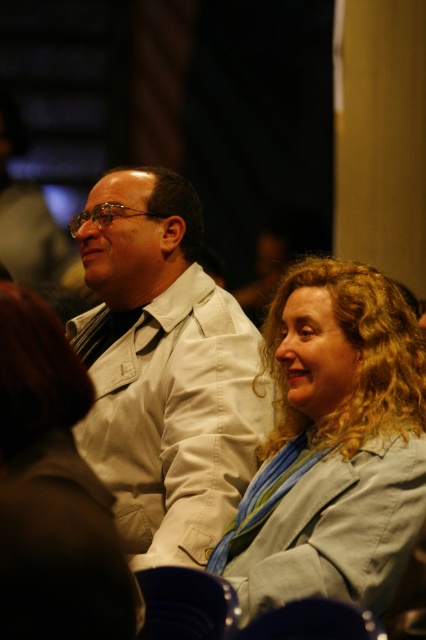
Who is shorter, light beige jacket at center or light blue fabric jacket at center?

With less height is light blue fabric jacket at center.

Who is lower down, light beige jacket at center or light blue fabric jacket at center?

light blue fabric jacket at center is lower down.

Is point (224, 452) closer to viewer compared to point (247, 532)?

No, (224, 452) is behind (247, 532).

This screenshot has height=640, width=426. Identify the location of light beige jacket at center. (164, 371).